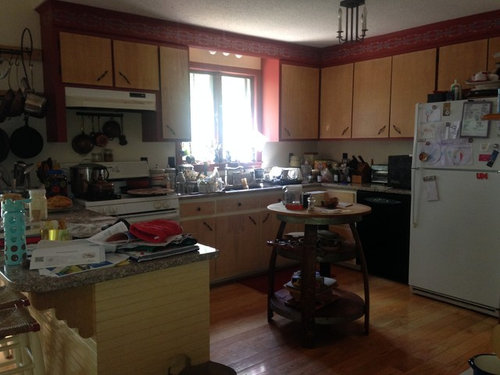
Find the location of a particular element. The image size is (500, 375). knob is located at coordinates (157, 203).